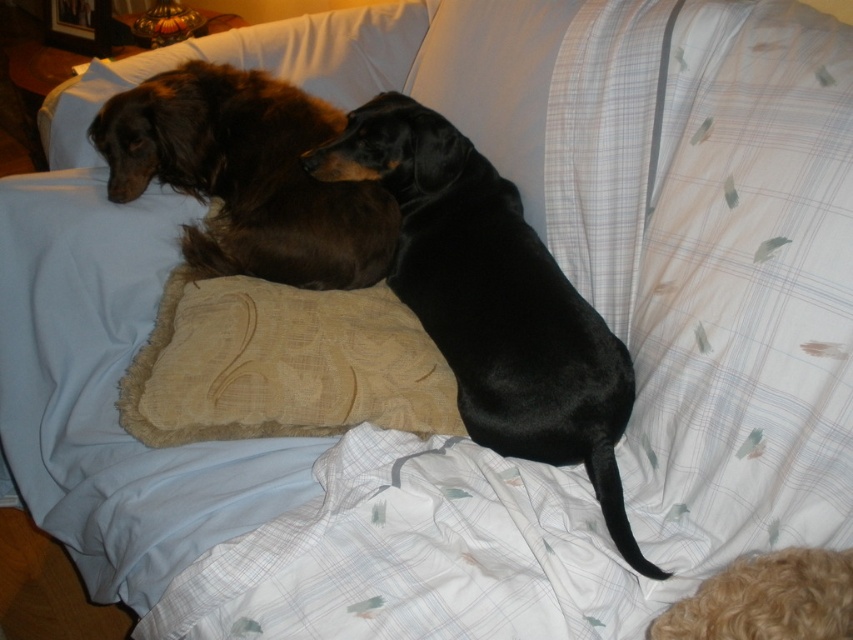
Is black smooth dog at center shorter than shiny brown fur at upper left?

Incorrect, black smooth dog at center's height does not fall short of shiny brown fur at upper left's.

In the scene shown: Between black smooth dog at center and shiny brown fur at upper left, which one is positioned higher?

shiny brown fur at upper left is higher up.

Is point (553, 451) less distant than point (329, 211)?

That is True.

Identify the location of black smooth dog at center. The width and height of the screenshot is (853, 640). (492, 300).